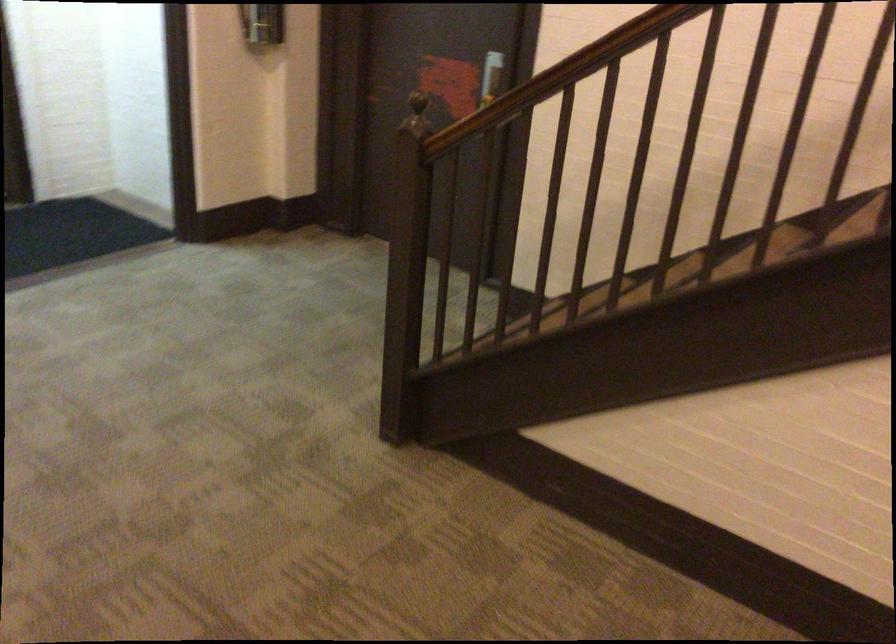
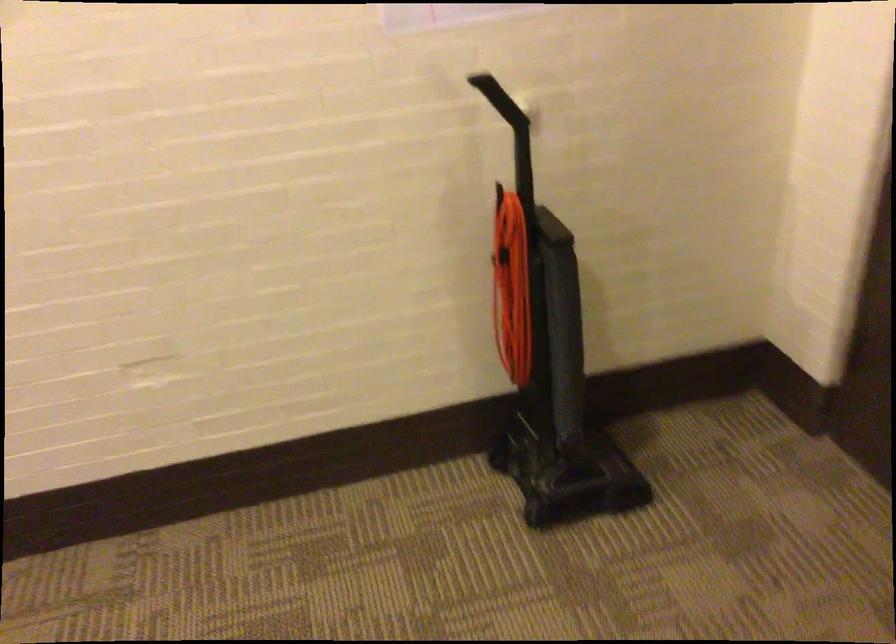
Based on the continuous images, in which direction is the camera rotating?

The camera rotated toward right-down.